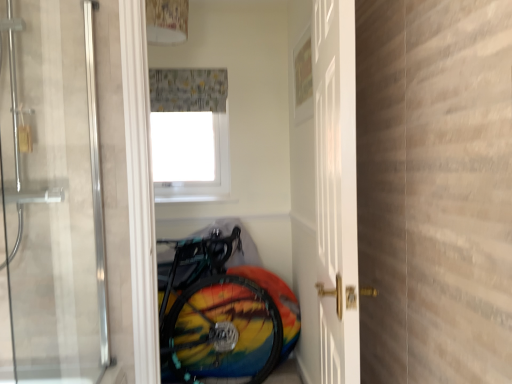
Question: Does printed fabric shower curtain at upper center have a larger size compared to rainbow painted tire at lower center?

Choices:
 (A) yes
 (B) no

Answer: (B)

Question: From the image's perspective, is printed fabric shower curtain at upper center on rainbow painted tire at lower center?

Choices:
 (A) yes
 (B) no

Answer: (A)

Question: Can you confirm if printed fabric shower curtain at upper center is taller than rainbow painted tire at lower center?

Choices:
 (A) no
 (B) yes

Answer: (A)

Question: Does printed fabric shower curtain at upper center lie behind rainbow painted tire at lower center?

Choices:
 (A) yes
 (B) no

Answer: (A)

Question: Is the depth of printed fabric shower curtain at upper center less than that of rainbow painted tire at lower center?

Choices:
 (A) no
 (B) yes

Answer: (A)

Question: Choose the correct answer: Is printed fabric shower curtain at upper center inside white matte window screen at upper center or outside it?

Choices:
 (A) outside
 (B) inside

Answer: (A)

Question: Is point (184, 99) positioned closer to the camera than point (184, 117)?

Choices:
 (A) closer
 (B) farther

Answer: (A)

Question: From a real-world perspective, is printed fabric shower curtain at upper center physically located above or below white matte window screen at upper center?

Choices:
 (A) below
 (B) above

Answer: (B)

Question: Visually, is printed fabric shower curtain at upper center positioned to the left or to the right of white matte window screen at upper center?

Choices:
 (A) left
 (B) right

Answer: (B)

Question: Is rainbow painted tire at lower center taller or shorter than white glossy door at center, which is counted as the second door, starting from the left?

Choices:
 (A) short
 (B) tall

Answer: (A)

Question: Does point (245, 359) appear closer or farther from the camera than point (307, 140)?

Choices:
 (A) closer
 (B) farther

Answer: (B)

Question: Based on their sizes in the image, would you say rainbow painted tire at lower center is bigger or smaller than white glossy door at center, which is the first door from right to left?

Choices:
 (A) small
 (B) big

Answer: (A)

Question: Would you say rainbow painted tire at lower center is inside or outside white glossy door at center, which is counted as the second door, starting from the left?

Choices:
 (A) inside
 (B) outside

Answer: (B)

Question: Looking at the image, does white glossy door at center, which is counted as the second door, starting from the left, seem bigger or smaller compared to transparent glass door at center, positioned as the 1th door in left-to-right order?

Choices:
 (A) big
 (B) small

Answer: (A)

Question: Considering the positions of white glossy door at center, which is the first door from right to left, and transparent glass door at center, positioned as the 1th door in left-to-right order, in the image, is white glossy door at center, which is the first door from right to left, taller or shorter than transparent glass door at center, positioned as the 1th door in left-to-right order,?

Choices:
 (A) short
 (B) tall

Answer: (B)